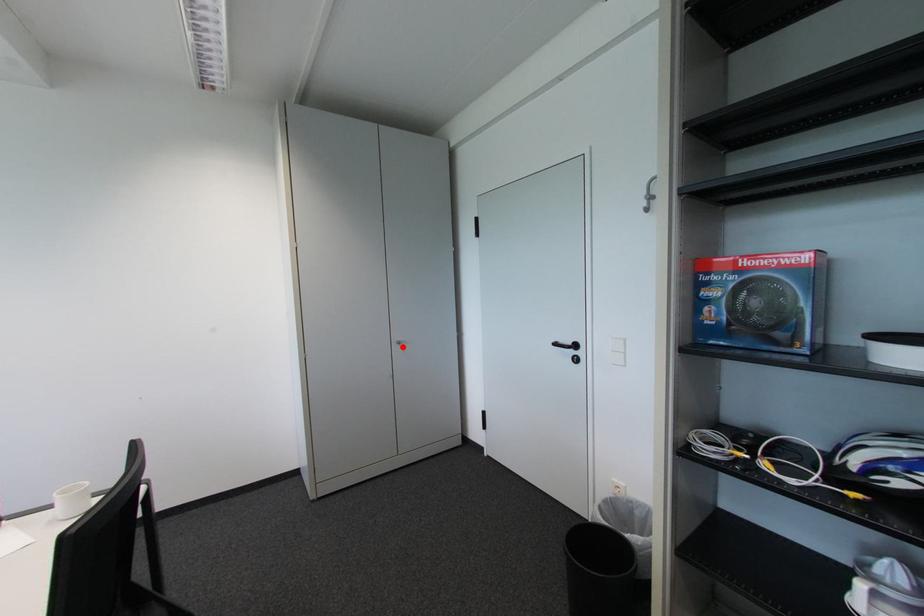
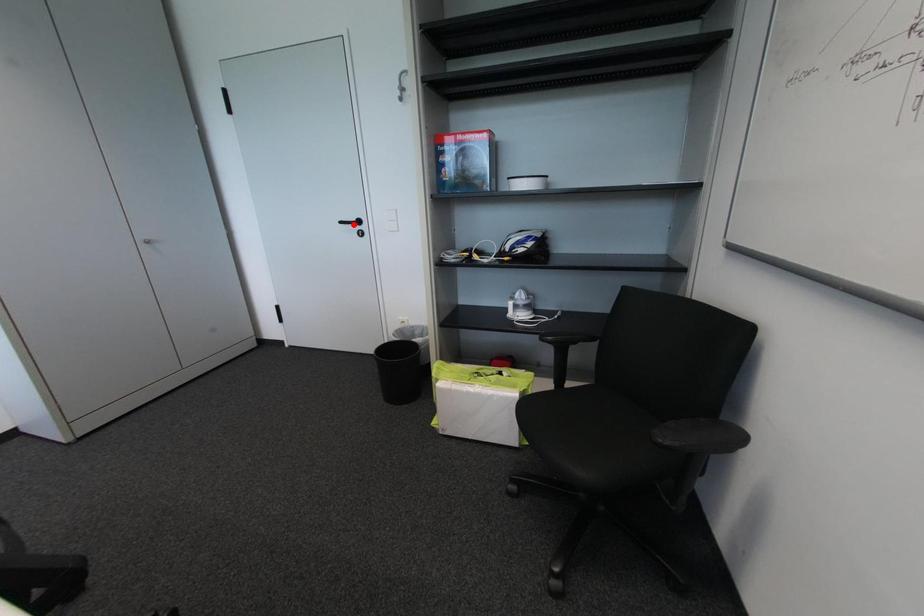
I am providing you with two images of the same scene from different viewpoints. A red point is marked on the first image and another point is marked on the second image. Does the point marked in image1 correspond to the same location as the one in image2?

No